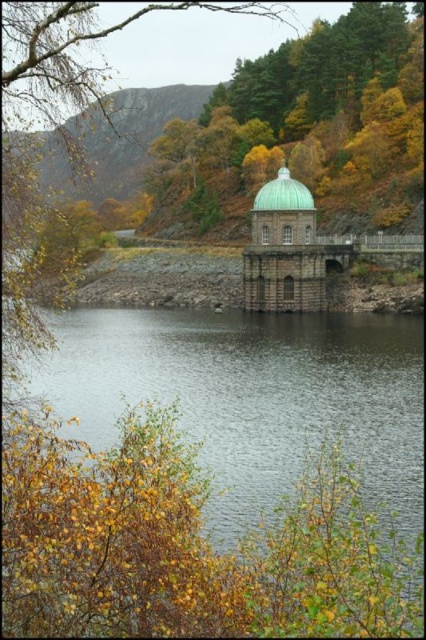
Is transparent water at center bigger than green matte dome at center?

No.

Who is more forward, (321, 566) or (377, 189)?

Point (321, 566)

This screenshot has width=426, height=640. Describe the element at coordinates (216, 477) in the screenshot. I see `transparent water at center` at that location.

Locate an element on the screen. transparent water at center is located at coordinates (216, 477).

Between green matte dome at center and green polished dome at center, which one has less height?

With less height is green polished dome at center.

Is green matte dome at center positioned behind green polished dome at center?

Yes, green matte dome at center is further from the viewer.

The width and height of the screenshot is (426, 640). Describe the element at coordinates (302, 128) in the screenshot. I see `green matte dome at center` at that location.

I want to click on green matte dome at center, so click(x=302, y=128).

Does transparent water at center have a greater width compared to green polished dome at center?

Indeed, transparent water at center has a greater width compared to green polished dome at center.

Between transparent water at center and green polished dome at center, which one has less height?

green polished dome at center

Is point (71, 598) more distant than point (258, 209)?

No.

This screenshot has width=426, height=640. What are the coordinates of `transparent water at center` in the screenshot? It's located at (216, 477).